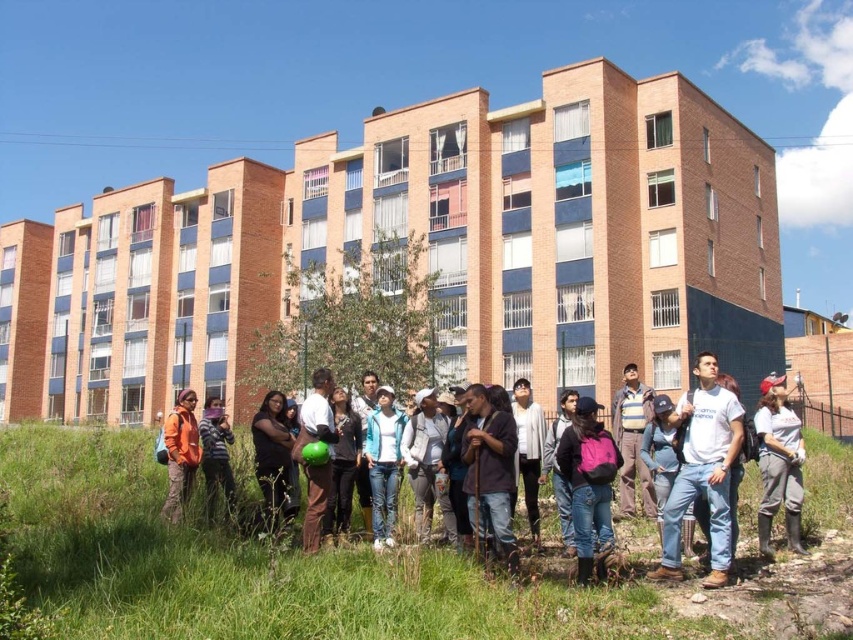
Does white cotton t-shirt at center have a lesser height compared to gray rubber boots at lower right?

In fact, white cotton t-shirt at center may be taller than gray rubber boots at lower right.

Is white cotton t-shirt at center taller than gray rubber boots at lower right?

Yes.

Who is more forward, (723, 506) or (793, 468)?

Positioned in front is point (723, 506).

Where is `white cotton t-shirt at center`? The width and height of the screenshot is (853, 640). white cotton t-shirt at center is located at coordinates coord(703,470).

In the scene shown: How distant is gray rubber boots at lower right from orange fabric jacket at lower left?

gray rubber boots at lower right is 85.23 feet from orange fabric jacket at lower left.

The width and height of the screenshot is (853, 640). I want to click on gray rubber boots at lower right, so click(x=778, y=464).

At what (x,y) coordinates should I click in order to perform the action: click on gray rubber boots at lower right. Please return your answer as a coordinate pair (x, y). Looking at the image, I should click on (778, 464).

Does pink fabric backpack at center appear on the right side of gray rubber boots at lower right?

Incorrect, pink fabric backpack at center is not on the right side of gray rubber boots at lower right.

Who is positioned more to the left, pink fabric backpack at center or gray rubber boots at lower right?

From the viewer's perspective, pink fabric backpack at center appears more on the left side.

In the scene shown: Who is more forward, (590, 493) or (772, 426)?

Point (590, 493) is more forward.

Locate an element on the screen. This screenshot has width=853, height=640. pink fabric backpack at center is located at coordinates 589,484.